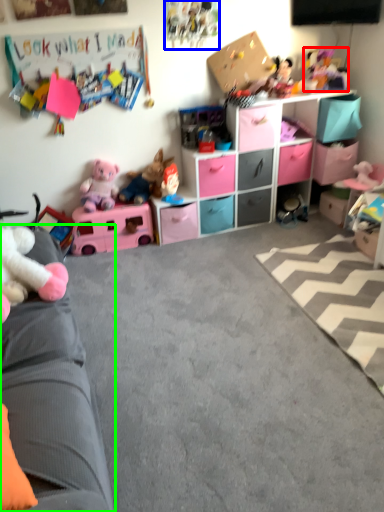
Question: Which is farther away from toy (highlighted by a red box)? toy (highlighted by a blue box) or studio couch (highlighted by a green box)?

Choices:
 (A) toy
 (B) studio couch

Answer: (B)